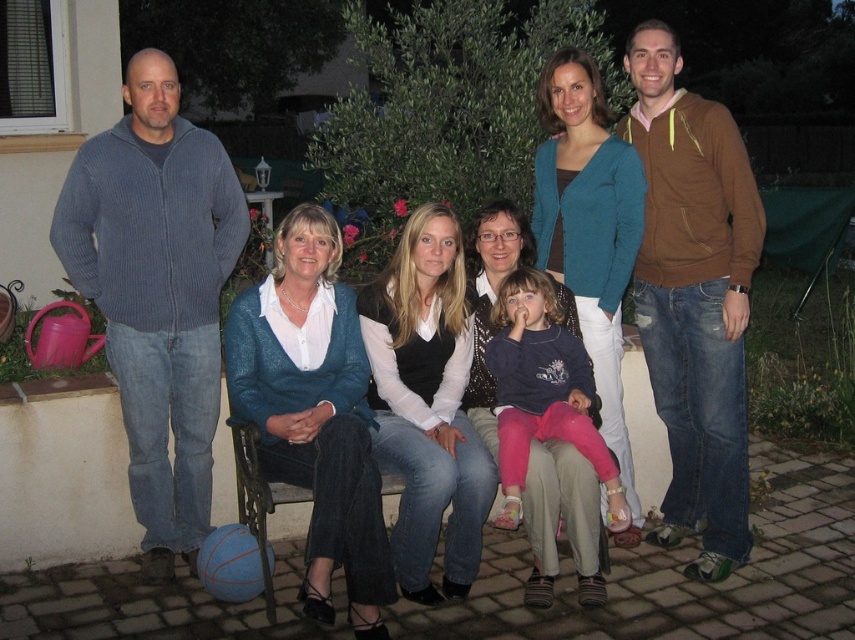
Question: Is blue ribbed sweater at left thinner than brown hoodie at right?

Choices:
 (A) no
 (B) yes

Answer: (A)

Question: Is blue ribbed sweater at left to the right of brown hoodie at right from the viewer's perspective?

Choices:
 (A) yes
 (B) no

Answer: (B)

Question: Considering the relative positions of blue ribbed sweater at left and brown hoodie at right in the image provided, where is blue ribbed sweater at left located with respect to brown hoodie at right?

Choices:
 (A) right
 (B) left

Answer: (B)

Question: Which of the following is the farthest from the observer?

Choices:
 (A) (146, 54)
 (B) (550, 312)

Answer: (B)

Question: Which point is closer to the camera?

Choices:
 (A) (187, 349)
 (B) (724, 538)

Answer: (A)

Question: Among these points, which one is nearest to the camera?

Choices:
 (A) (618, 129)
 (B) (154, 154)
 (C) (559, 381)

Answer: (B)